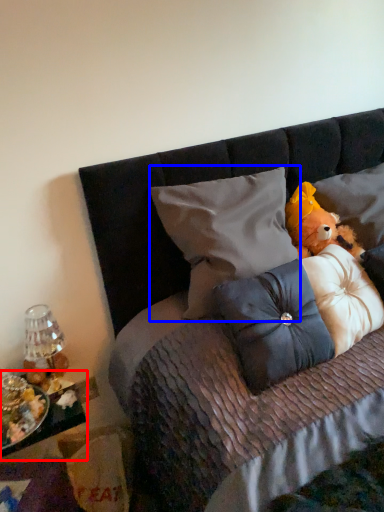
Question: Which point is closer to the camera, table (highlighted by a red box) or pillow (highlighted by a blue box)?

Choices:
 (A) table
 (B) pillow

Answer: (A)